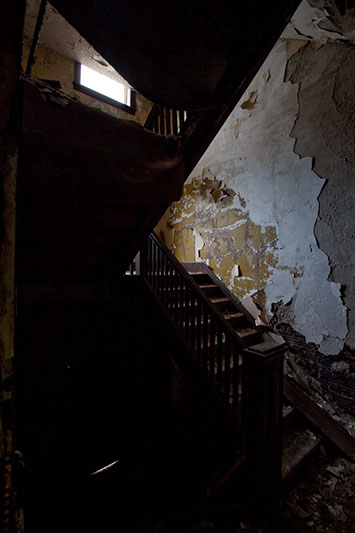
In order to click on staircase in this screenshot , I will do `click(221, 306)`.